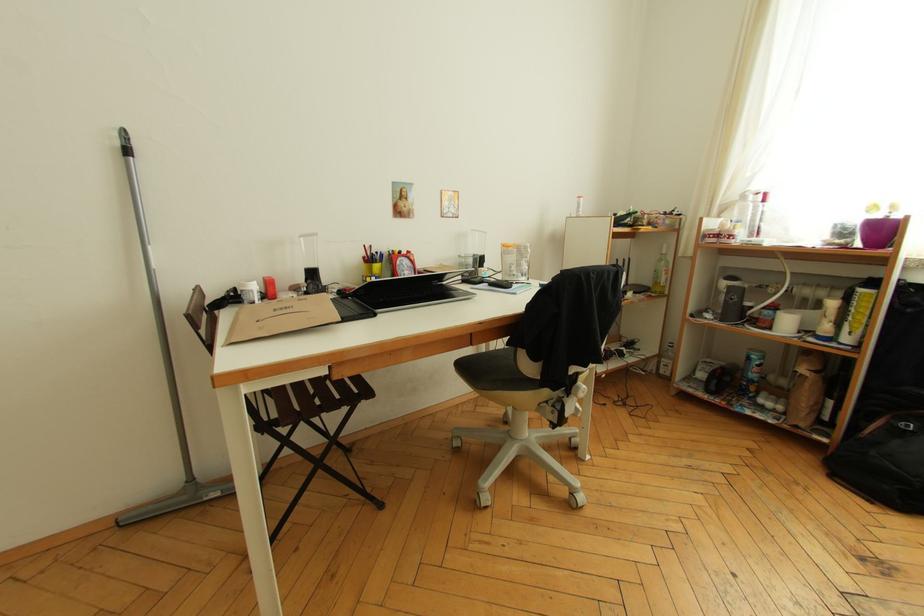
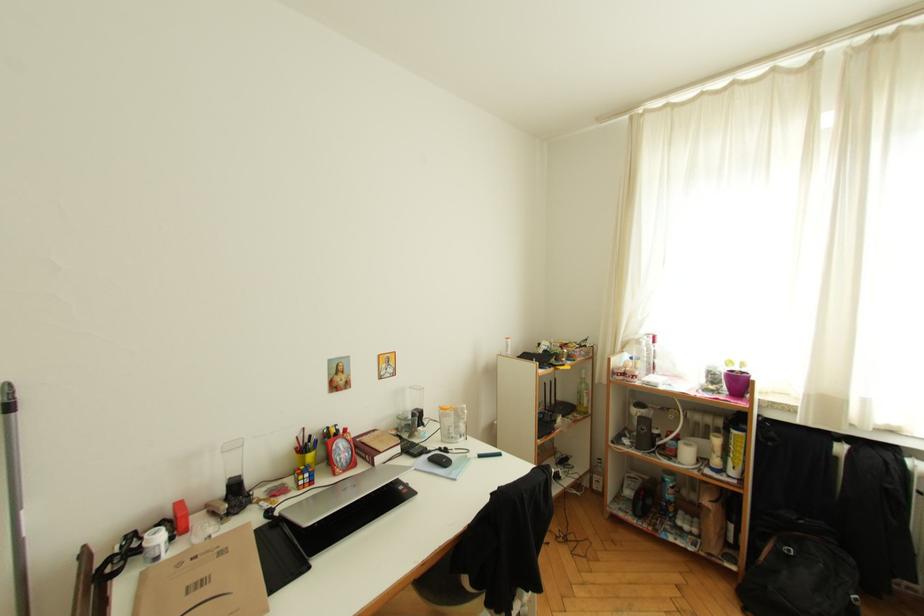
Question: The images are taken continuously from a first-person perspective. In which direction are you moving?

Choices:
 (A) Left
 (B) Right
 (C) Forward
 (D) Backward

Answer: (D)